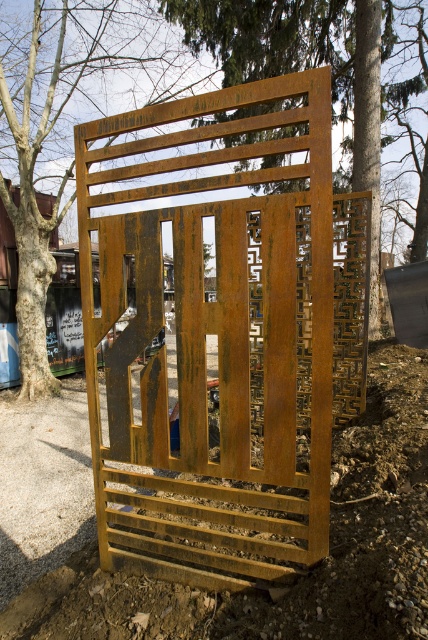
Is rusty metal tree at center positioned in front of rusty metal fence at center?

No, it is behind rusty metal fence at center.

Does rusty metal tree at center appear under rusty metal fence at center?

No, rusty metal tree at center is not below rusty metal fence at center.

Which is in front, point (44, 93) or point (347, 24)?

Point (347, 24)

This screenshot has height=640, width=428. What are the coordinates of `rusty metal tree at center` in the screenshot? It's located at (70, 118).

Locate an element on the screen. This screenshot has width=428, height=640. rusty metal gate at center is located at coordinates (217, 346).

Is rusty metal gate at center thinner than rusty metal fence at center?

Correct, rusty metal gate at center's width is less than rusty metal fence at center's.

Image resolution: width=428 pixels, height=640 pixels. What are the coordinates of `rusty metal gate at center` in the screenshot? It's located at (217, 346).

Does rusty metal gate at center have a lesser height compared to rusty metal tree at center?

Incorrect, rusty metal gate at center's height does not fall short of rusty metal tree at center's.

Who is positioned more to the right, rusty metal gate at center or rusty metal tree at center?

rusty metal gate at center

Which is behind, point (246, 429) or point (115, 81)?

The point (115, 81) is more distant.

At what (x,y) coordinates should I click in order to perform the action: click on rusty metal gate at center. Please return your answer as a coordinate pair (x, y). Image resolution: width=428 pixels, height=640 pixels. Looking at the image, I should click on (217, 346).